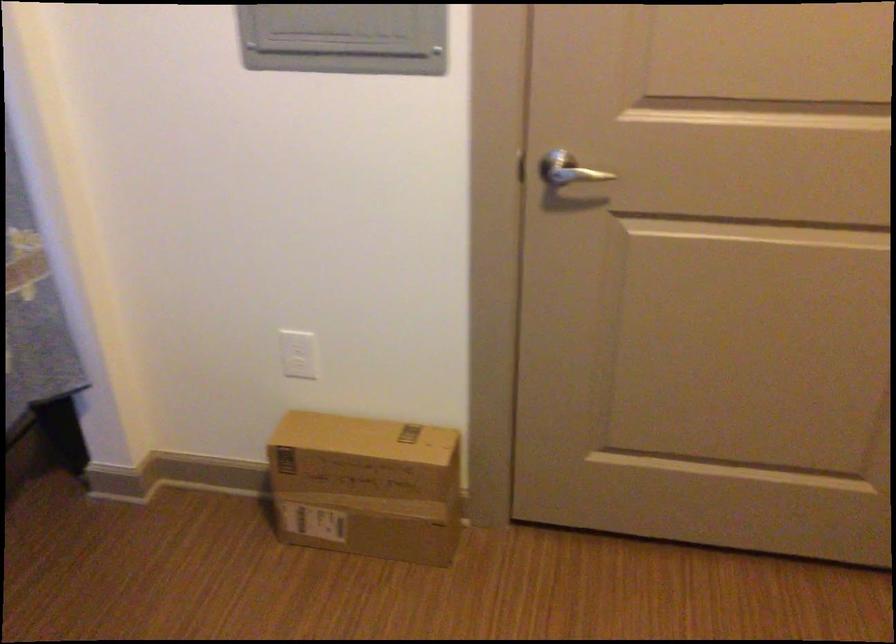
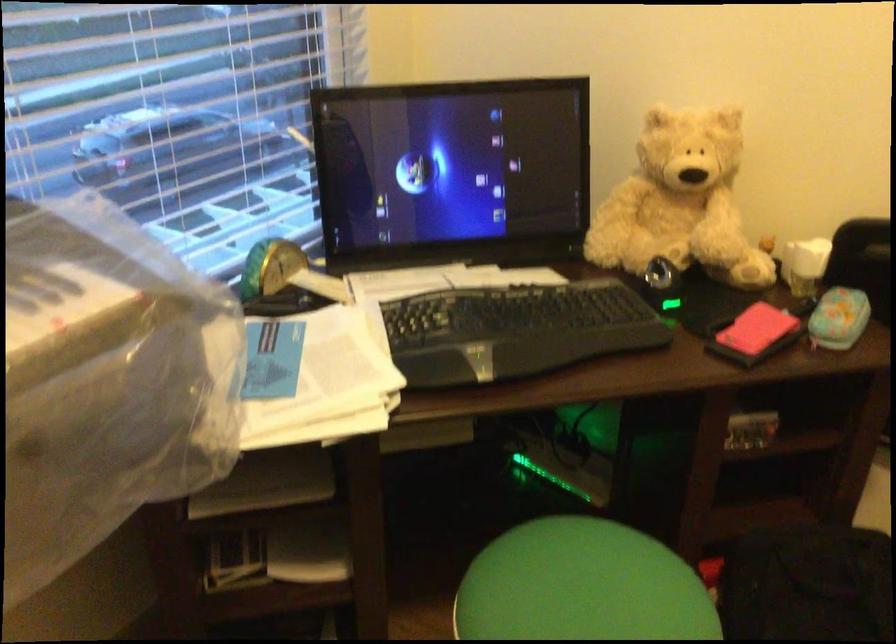
How did the camera likely rotate?

The rotation direction of the camera is left-down.